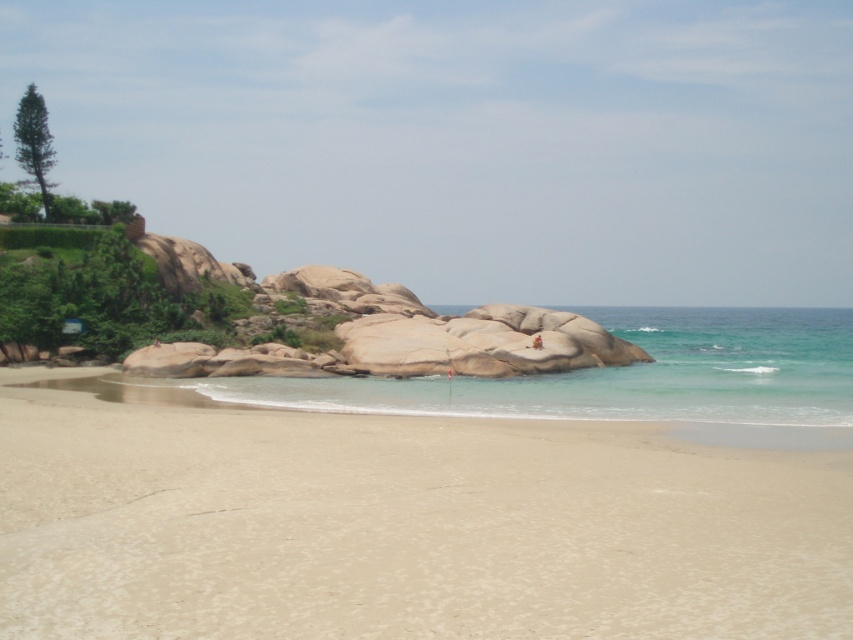
Who is more forward, (x=846, y=472) or (x=849, y=332)?

Point (x=846, y=472) is more forward.

Does point (834, 550) lie in front of point (596, 397)?

Yes.

Where is `smooth sand at center`? Image resolution: width=853 pixels, height=640 pixels. smooth sand at center is located at coordinates (403, 525).